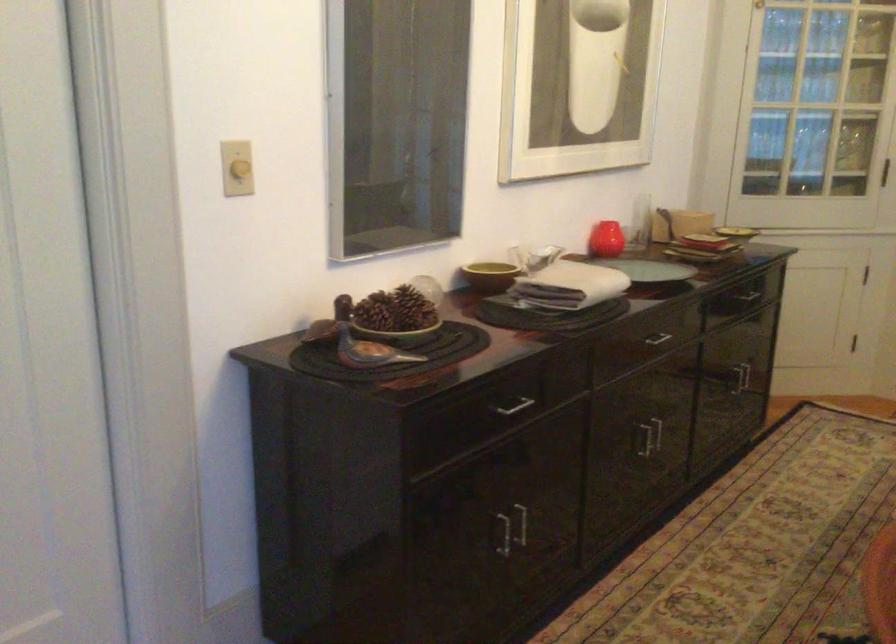
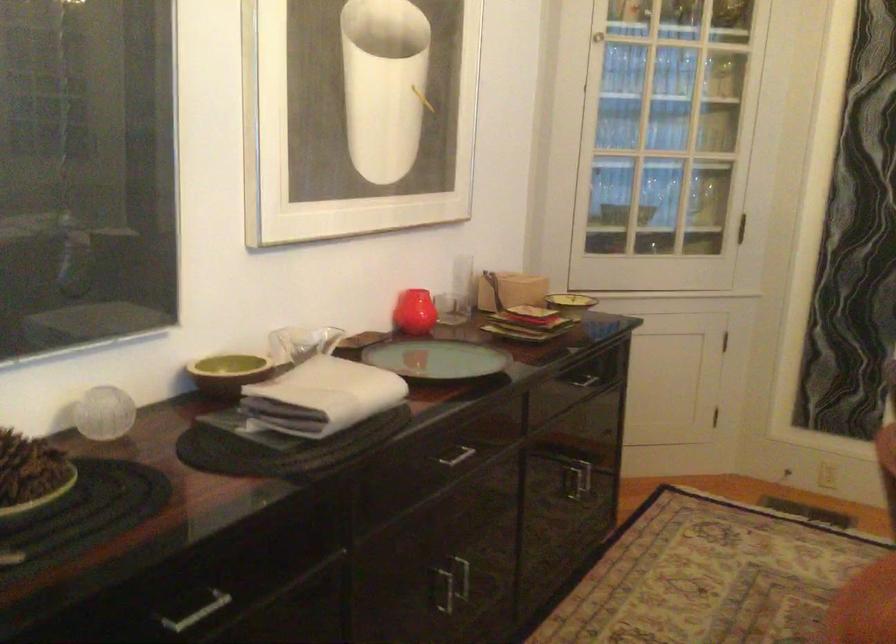
The point at (612, 239) is marked in the first image. Where is the corresponding point in the second image?

(414, 312)